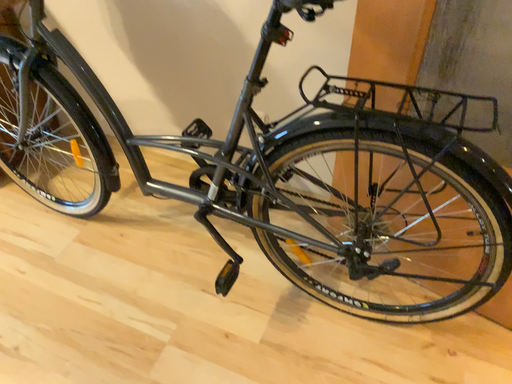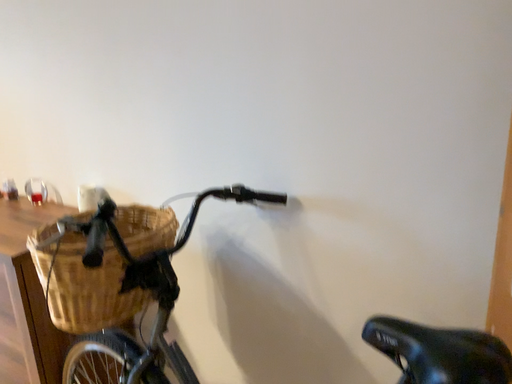
Question: How did the camera likely rotate when shooting the video?

Choices:
 (A) rotated upward
 (B) rotated downward

Answer: (A)